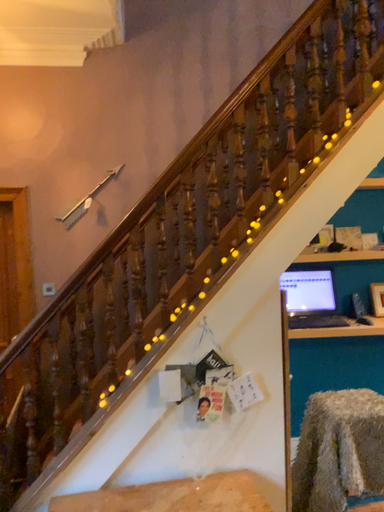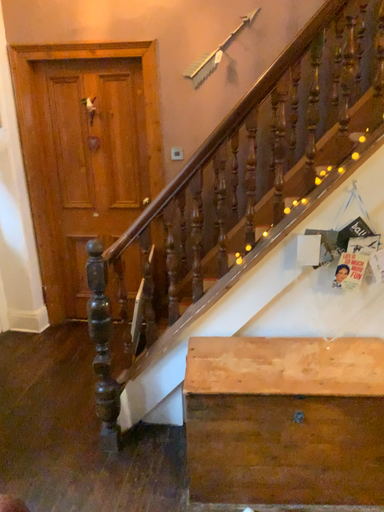
Question: How did the camera likely rotate when shooting the video?

Choices:
 (A) rotated right
 (B) rotated left

Answer: (B)